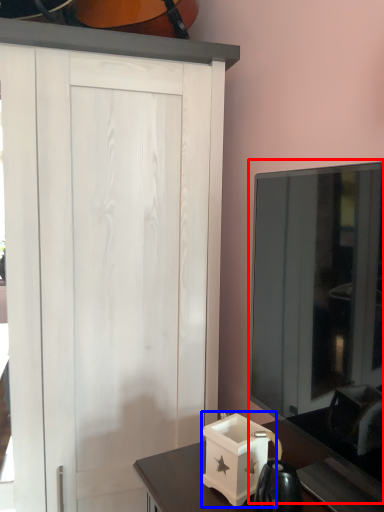
Question: Which of the following is the closest to the observer, glass door (highlighted by a red box) or box (highlighted by a blue box)?

Choices:
 (A) glass door
 (B) box

Answer: (A)